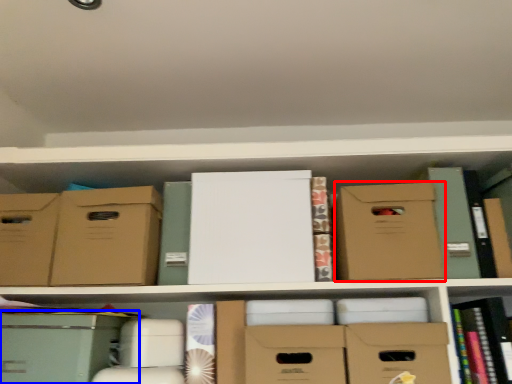
Question: Which of the following is the farthest to the observer, cardboard box (highlighted by a red box) or storage box (highlighted by a blue box)?

Choices:
 (A) cardboard box
 (B) storage box

Answer: (A)